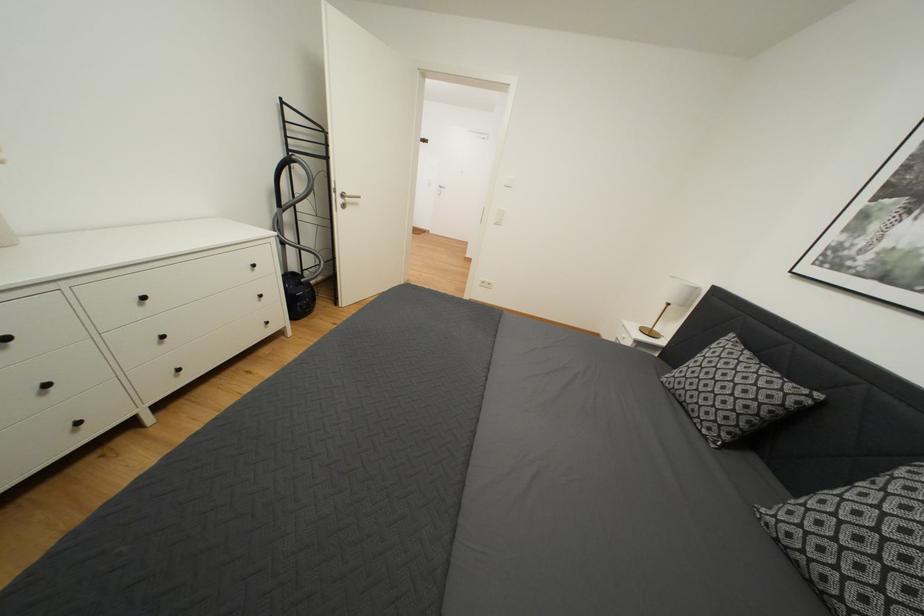
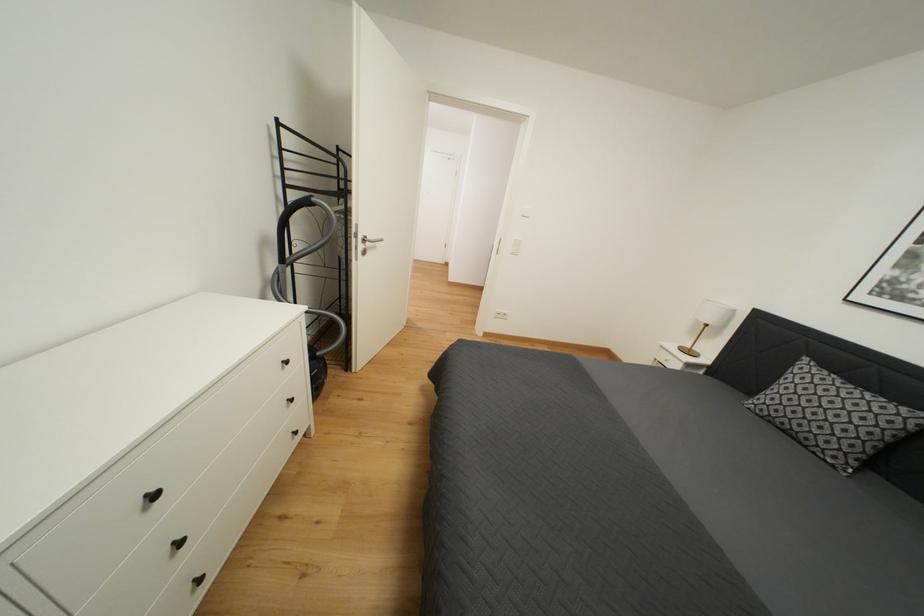
Question: How did the camera likely rotate?

Choices:
 (A) Left
 (B) Right
 (C) Up
 (D) Down

Answer: (B)